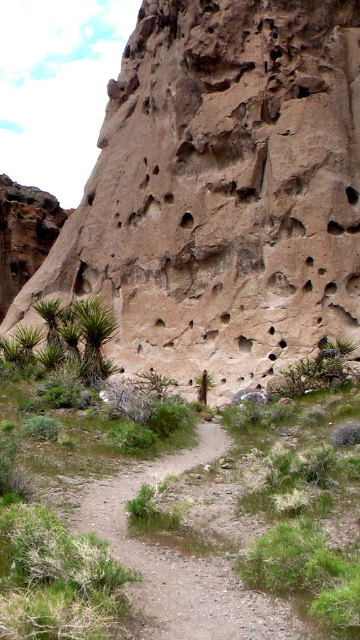
Between brown rough rock at center and dirt path at center, which one appears on the left side from the viewer's perspective?

From the viewer's perspective, brown rough rock at center appears more on the left side.

Is brown rough rock at center to the right of dirt path at center from the viewer's perspective?

Incorrect, brown rough rock at center is not on the right side of dirt path at center.

Who is more forward, (210,348) or (176,596)?

Positioned in front is point (176,596).

The width and height of the screenshot is (360, 640). Find the location of `brown rough rock at center`. brown rough rock at center is located at coordinates (222, 192).

Is brown rough rock at center positioned before green spiky plant at lower left?

No, brown rough rock at center is further to the viewer.

Does brown rough rock at center have a smaller size compared to green spiky plant at lower left?

Incorrect, brown rough rock at center is not smaller in size than green spiky plant at lower left.

Who is more forward, (297, 168) or (55, 333)?

Point (55, 333) is in front.

At what (x,y) coordinates should I click in order to perform the action: click on brown rough rock at center. Please return your answer as a coordinate pair (x, y). This screenshot has height=640, width=360. Looking at the image, I should click on (222, 192).

Is dirt path at center shorter than green spiky plant at lower left?

Indeed, dirt path at center has a lesser height compared to green spiky plant at lower left.

Between point (231, 620) and point (48, 324), which one is positioned behind?

Positioned behind is point (48, 324).

Is point (185, 614) behind point (48, 305)?

No, (185, 614) is closer to viewer.

The width and height of the screenshot is (360, 640). In order to click on dirt path at center in this screenshot , I will do `click(182, 560)`.